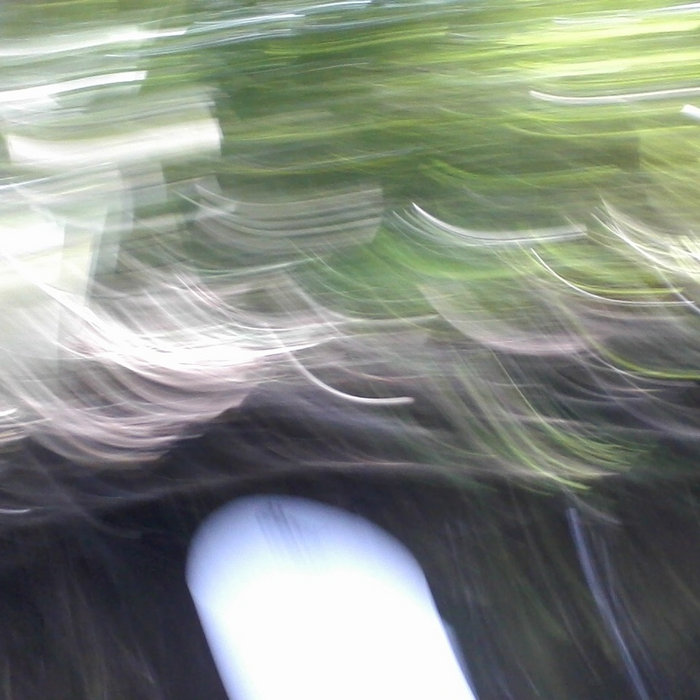
This screenshot has height=700, width=700. In order to click on light in this screenshot , I will do `click(182, 360)`.